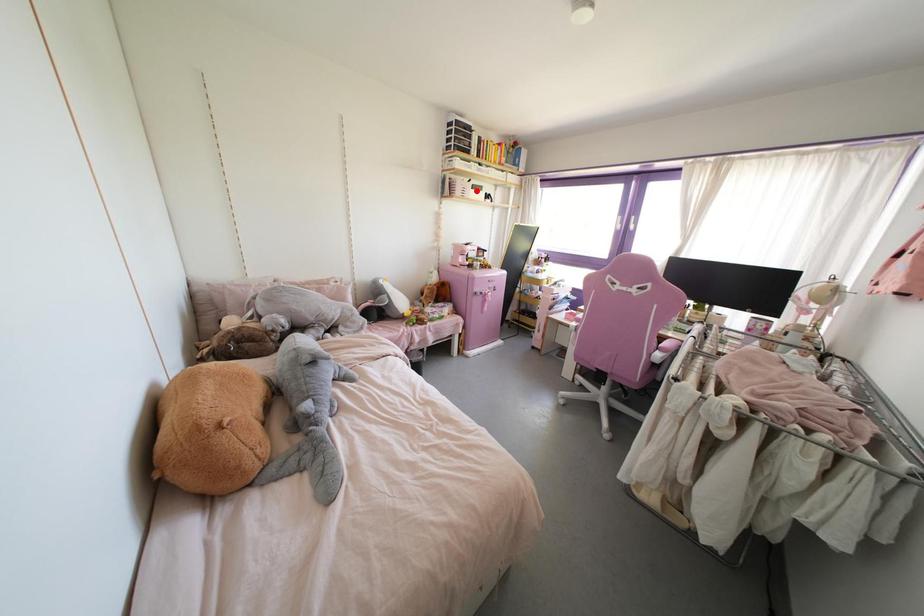
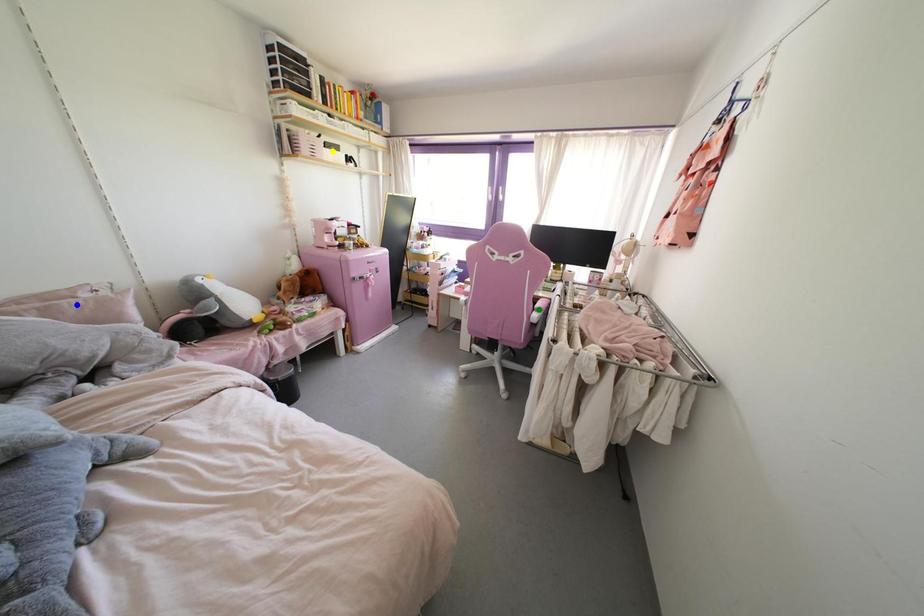
Question: I am providing you with two images of the same scene from different viewpoints. A red point is marked on the first image. You are given multiple points on the second image. Which mark in image 2 goes with the point in image 1?

Choices:
 (A) yellow point
 (B) blue point
 (C) green point

Answer: (A)